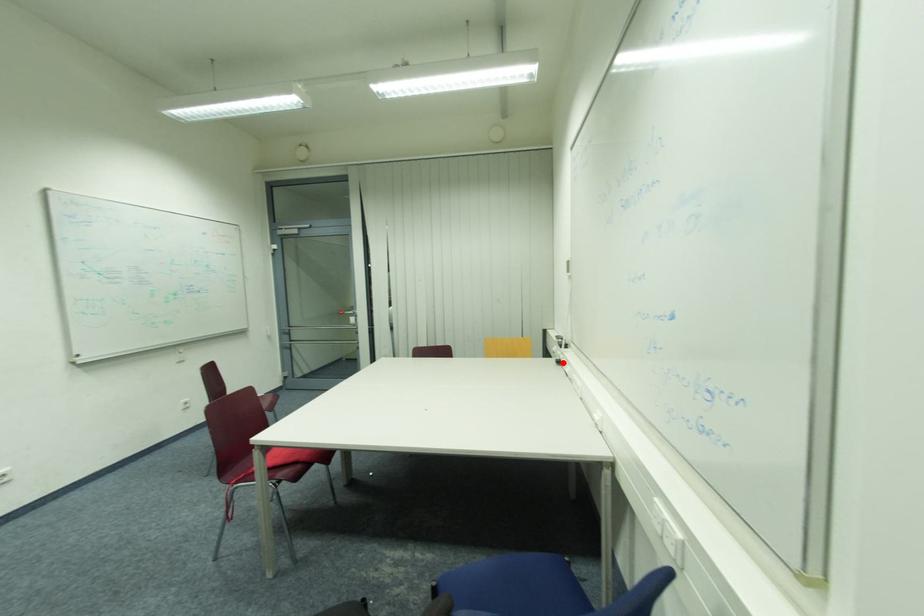
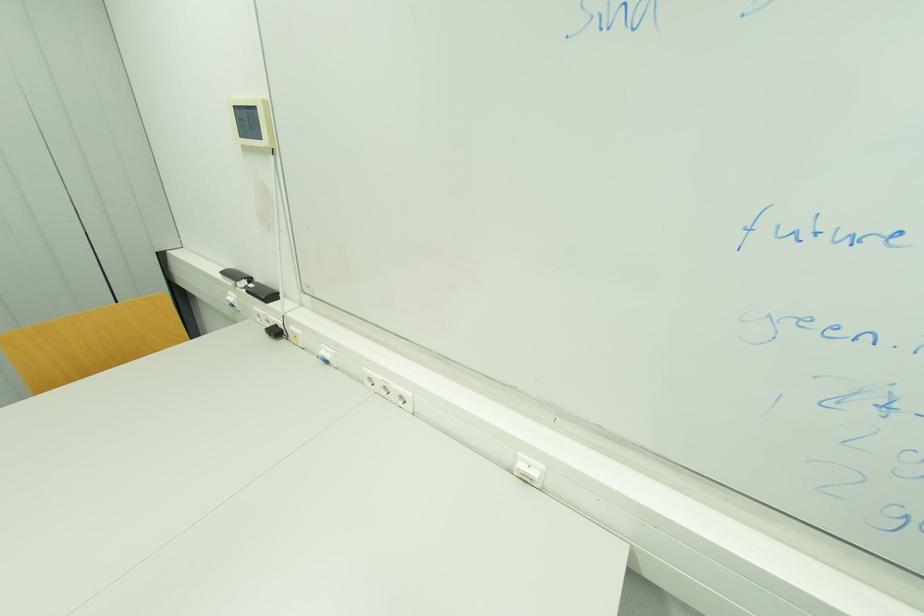
Question: I am providing you with two images of the same scene from different viewpoints. Given a red point in image1, look at the same physical point in image2. Is it:

Choices:
 (A) Closer to the viewpoint
 (B) Farther from the viewpoint

Answer: (B)